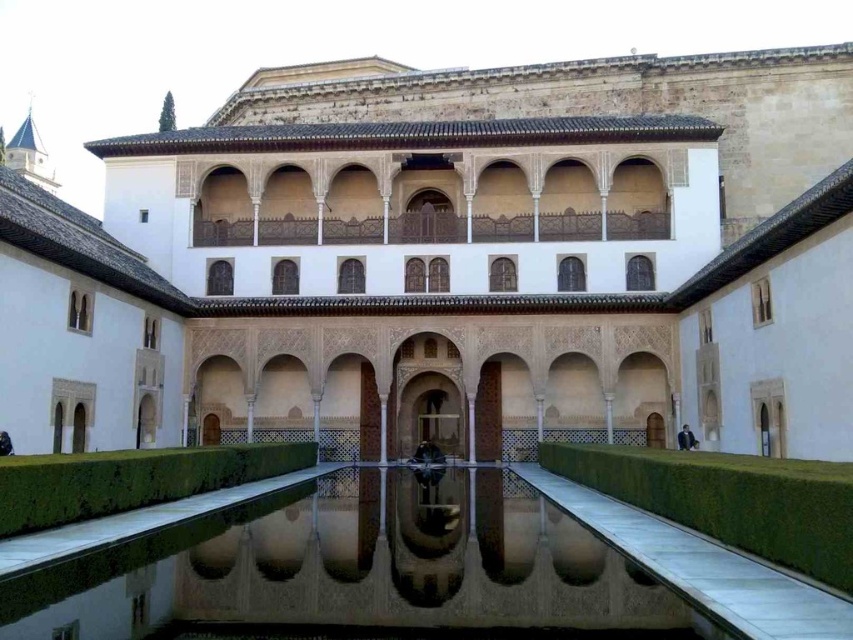
Question: Can you confirm if white stone building at center is thinner than green stone moat at lower right?

Choices:
 (A) yes
 (B) no

Answer: (B)

Question: Is clear glass water at center to the left of green stone moat at lower right from the viewer's perspective?

Choices:
 (A) yes
 (B) no

Answer: (A)

Question: Is clear glass water at center wider than green stone moat at lower right?

Choices:
 (A) no
 (B) yes

Answer: (B)

Question: Which of the following is the farthest from the observer?

Choices:
 (A) clear glass water at center
 (B) green stone moat at lower right

Answer: (B)

Question: Which is nearer to the green stone moat at lower right?

Choices:
 (A) white stone building at center
 (B) clear glass water at center

Answer: (B)

Question: Among these objects, which one is farthest from the camera?

Choices:
 (A) clear glass water at center
 (B) green stone moat at lower right

Answer: (B)